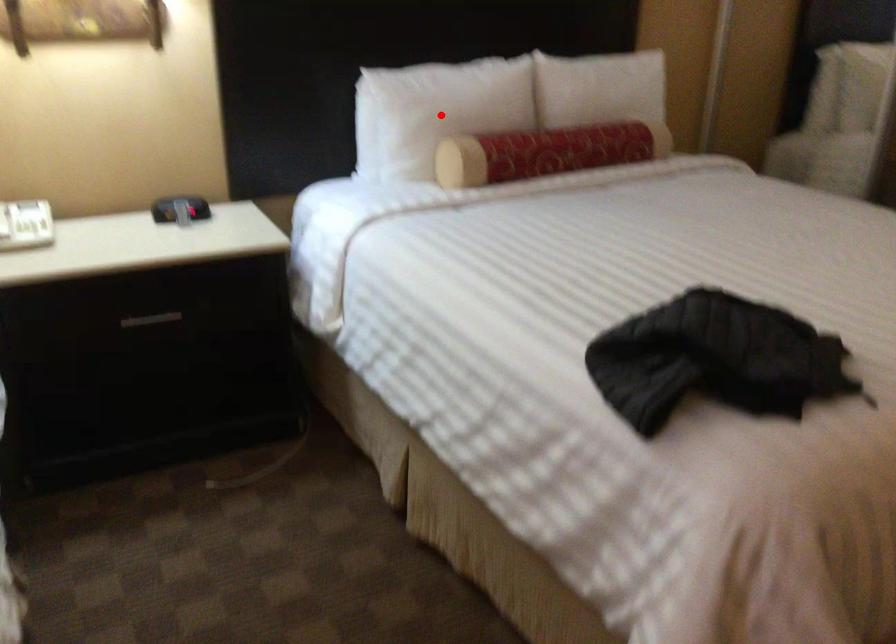
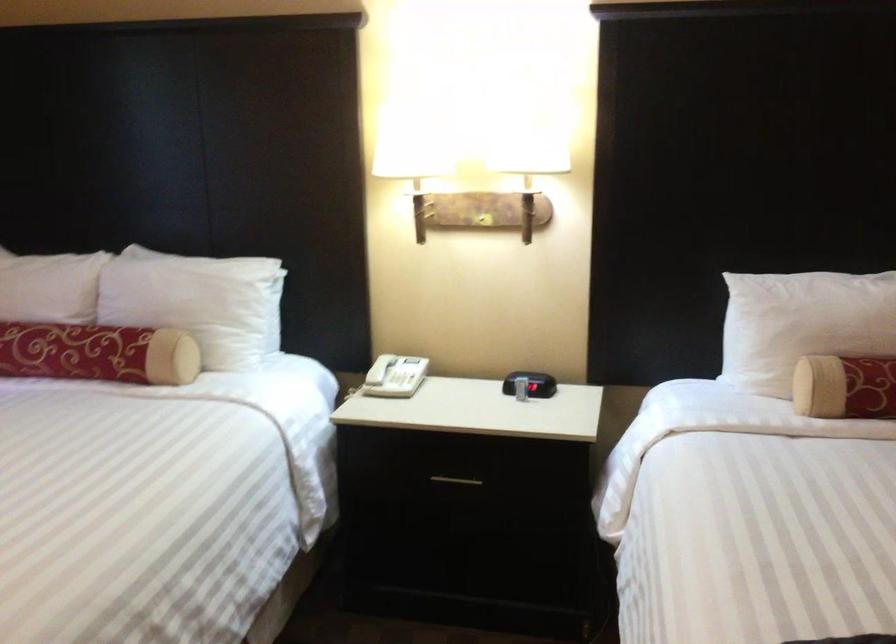
The point at the highlighted location is marked in the first image. Where is the corresponding point in the second image?

(802, 324)